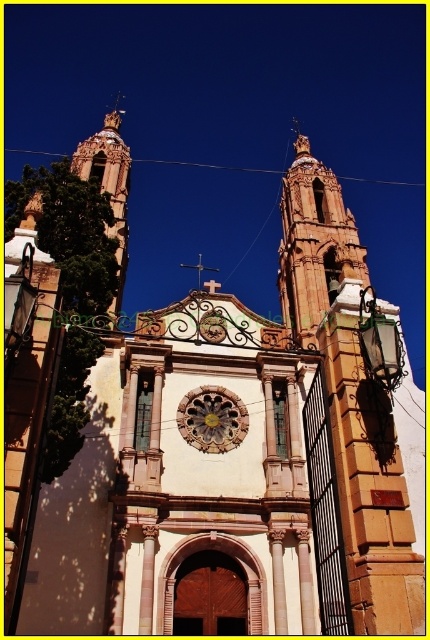
Question: Which object is positioned closest to the golden stone clock at center?

Choices:
 (A) gold metallic clock at center
 (B) smooth terracotta bell tower at upper center

Answer: (A)

Question: Does golden stone clock at center appear over gold metallic clock at center?

Choices:
 (A) no
 (B) yes

Answer: (A)

Question: Is the position of smooth terracotta bell tower at upper center less distant than that of golden stone clock at center?

Choices:
 (A) yes
 (B) no

Answer: (A)

Question: Among these points, which one is nearest to the camera?

Choices:
 (A) (218, 406)
 (B) (328, 188)
 (C) (212, 324)

Answer: (A)

Question: Is smooth terracotta bell tower at upper center closer to the viewer compared to golden stone clock at center?

Choices:
 (A) no
 (B) yes

Answer: (B)

Question: Which point is farther to the camera?

Choices:
 (A) gold metallic clock at center
 (B) smooth terracotta bell tower at upper center
 (C) golden stone clock at center

Answer: (A)